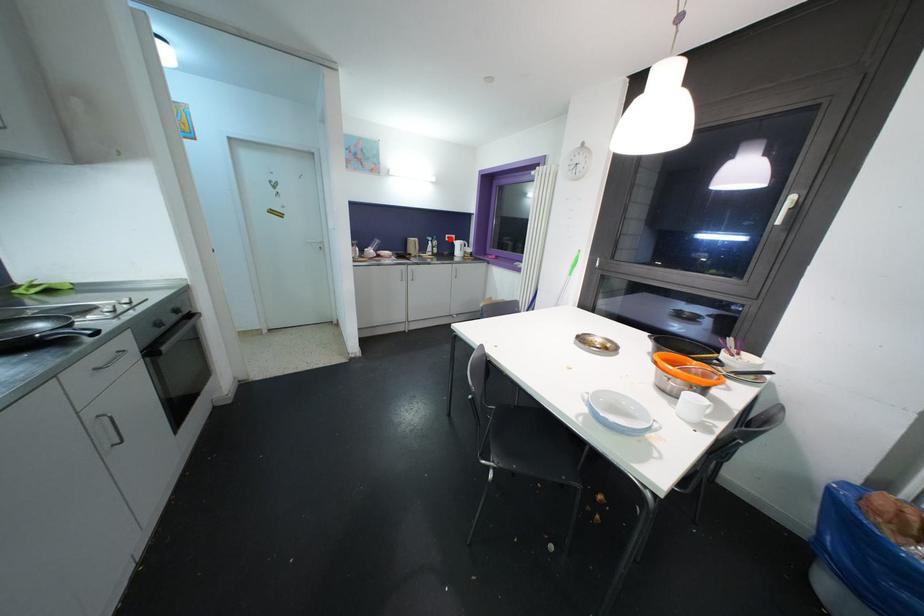
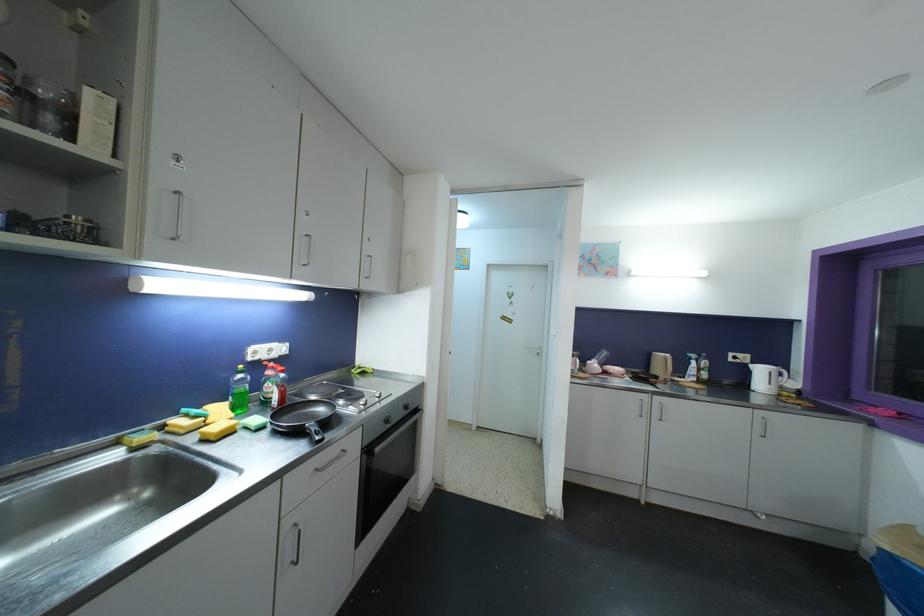
Question: I am providing you with two images of the same scene from different viewpoints. A red point is shown in image1. For the corresponding object point in image2, is it positioned nearer or farther from the camera?

Choices:
 (A) Nearer
 (B) Farther

Answer: (B)